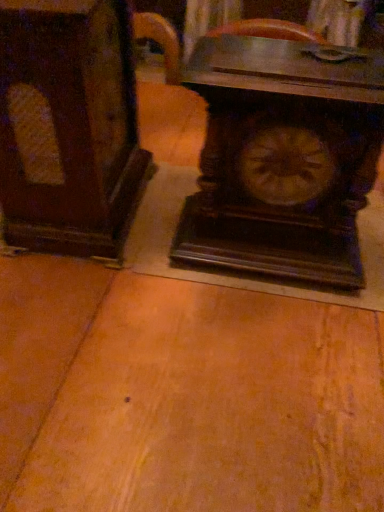
The width and height of the screenshot is (384, 512). Identify the location of vacant region above wooden carved clock at center (from a real-world perspective). (296, 56).